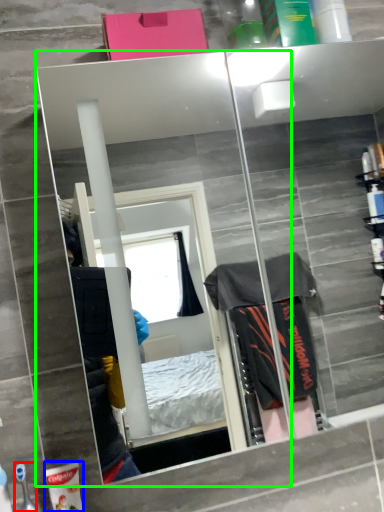
Question: Based on their relative distances, which object is farther from toiletry (highlighted by a red box)? Choose from toiletry (highlighted by a blue box) and mirror (highlighted by a green box).

Choices:
 (A) toiletry
 (B) mirror

Answer: (B)